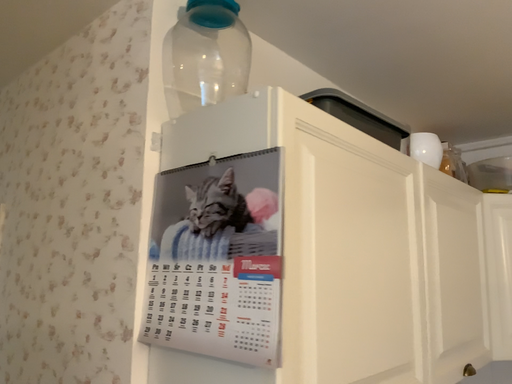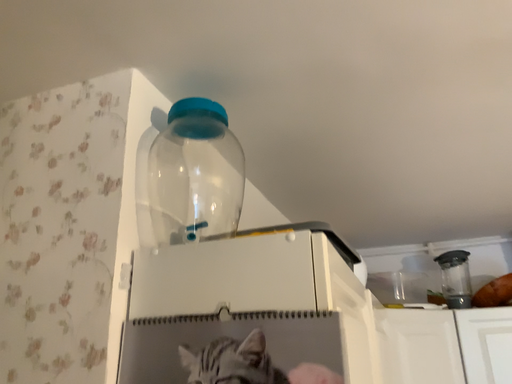
Question: Which way did the camera rotate in the video?

Choices:
 (A) rotated left
 (B) rotated right

Answer: (B)